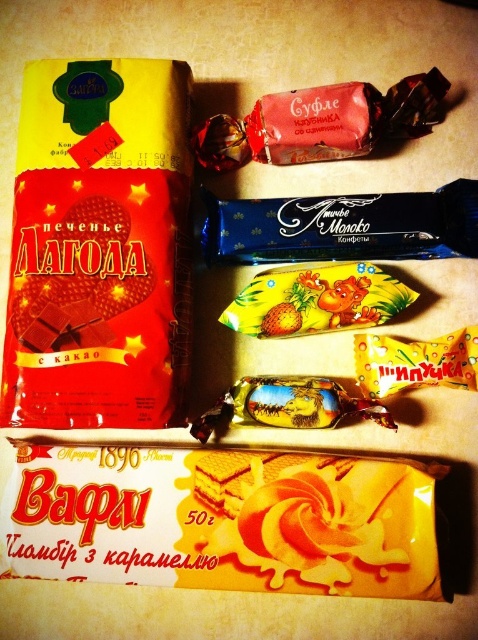
Question: Does blue glossy chocolate bar at center have a lesser width compared to yellow glossy candy at center?

Choices:
 (A) no
 (B) yes

Answer: (A)

Question: Which point appears closest to the camera in this image?

Choices:
 (A) (129, 516)
 (B) (302, 272)
 (C) (260, 198)

Answer: (A)

Question: Considering the real-world distances, which object is closest to the shiny chocolate bar at center?

Choices:
 (A) yellow creamy wafer at lower center
 (B) blue glossy chocolate bar at center

Answer: (B)

Question: Among these points, which one is nearest to the camera?

Choices:
 (A) (467, 353)
 (B) (194, 147)
 (C) (43, 502)
 (D) (383, 321)

Answer: (C)

Question: Can you confirm if yellow glossy candy at center is positioned to the left of shiny chocolate bar at center?

Choices:
 (A) no
 (B) yes

Answer: (A)

Question: In this image, where is blue glossy chocolate bar at center located relative to shiny chocolate bar at center?

Choices:
 (A) right
 (B) left

Answer: (A)